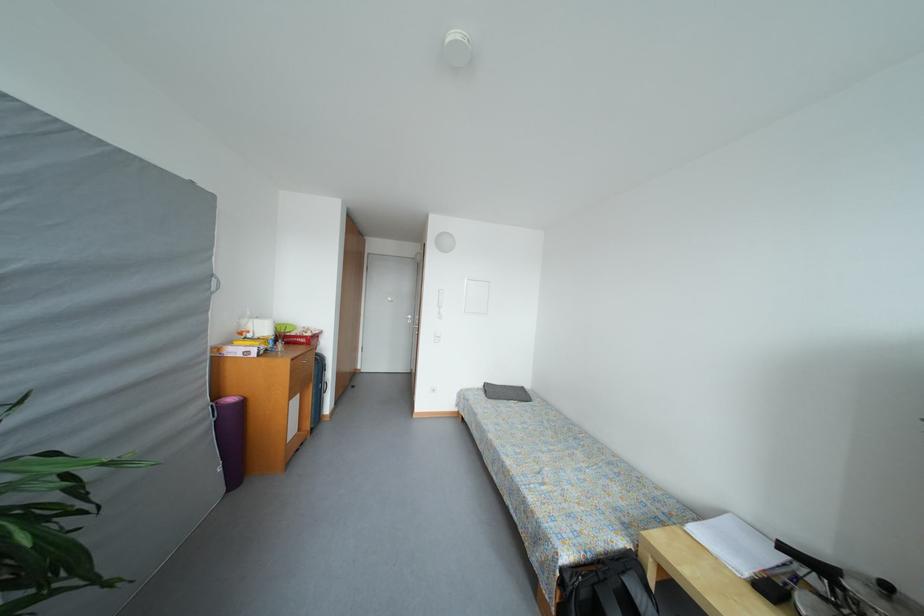
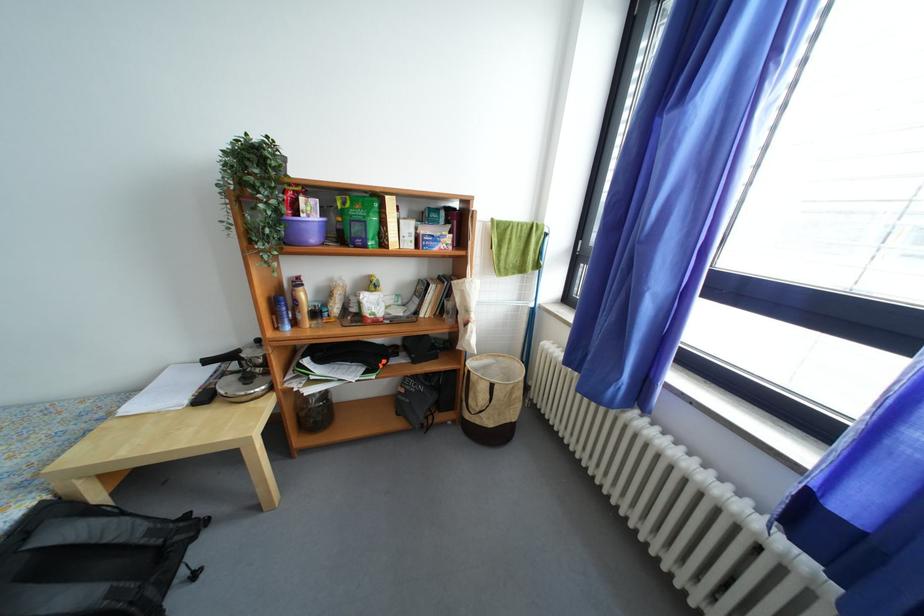
Where in the second image is the point corresponding to (x=831, y=575) from the first image?

(238, 361)